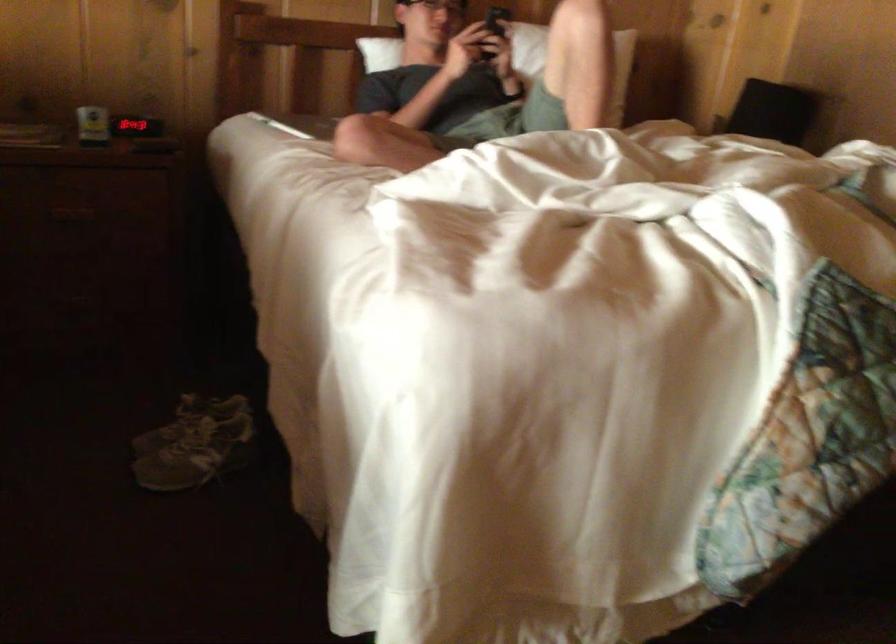
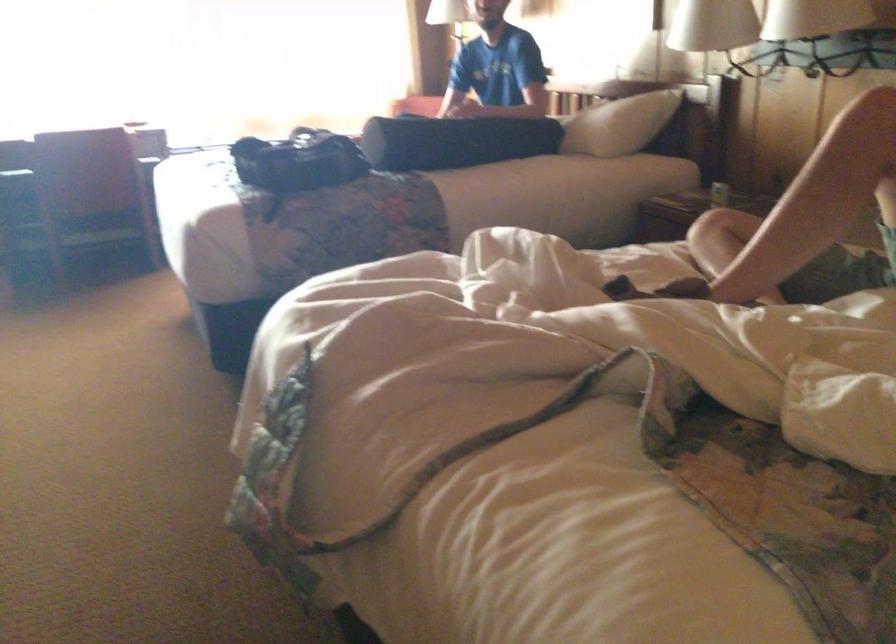
Question: I am providing you with two images of the same scene from different viewpoints. Please identify which objects are invisible in image2.

Choices:
 (A) black bolster pillow
 (B) small brown container
 (C) digital alarm clock
 (D) white pillow

Answer: (C)